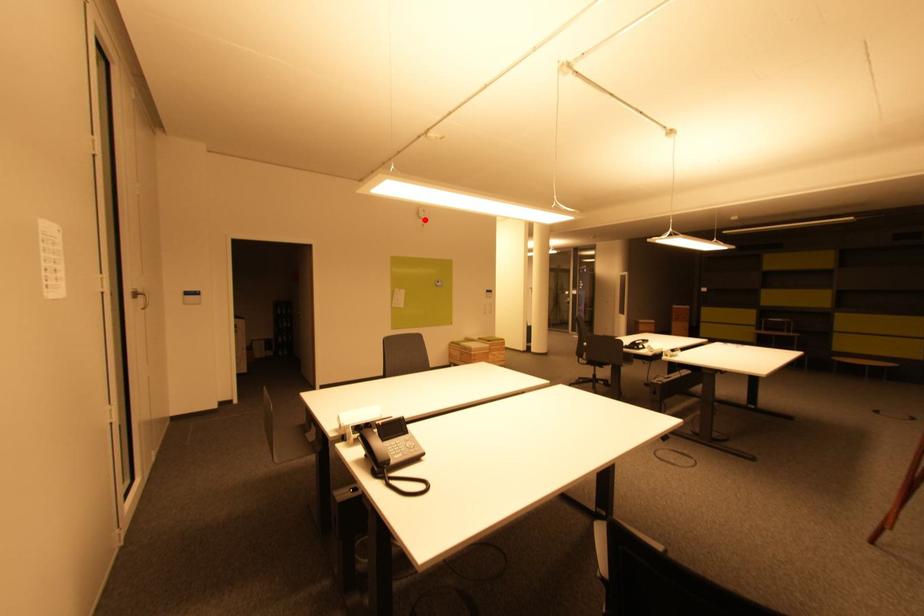
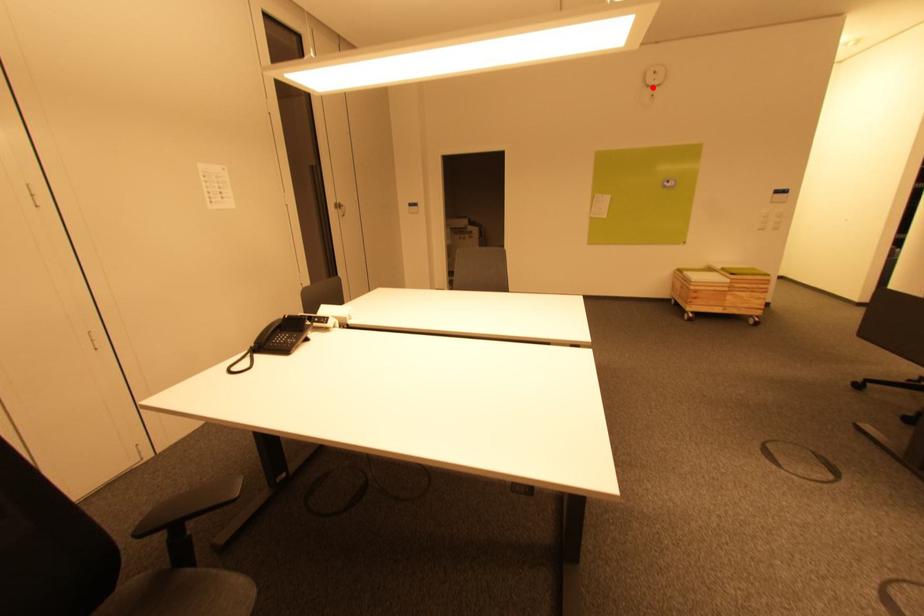
I am providing you with two images of the same scene from different viewpoints. A red point is marked on the first image and another point is marked on the second image. Do the highlighted points in image1 and image2 indicate the same real-world spot?

Yes